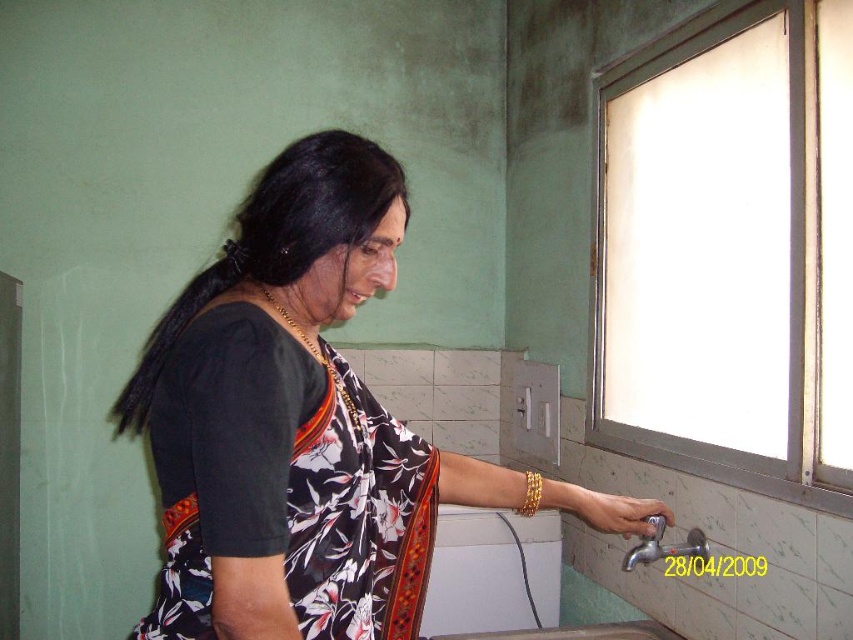
You are a fashion designer observing a woman wearing a black floral saree at center and standing near a metallic silver faucet at lower right. Which object takes up more space in the image?

The black floral saree at center takes up more space in the image as it is bigger than the metallic silver faucet at lower right.

You are a photographer taking a picture of the scene. The black floral fabric sari at center and the metallic silver faucet at lower right are both in your view. Which object will appear larger in the photo?

The black floral fabric sari at center will appear larger in the photo because it is closer to the viewer than the metallic silver faucet at lower right.